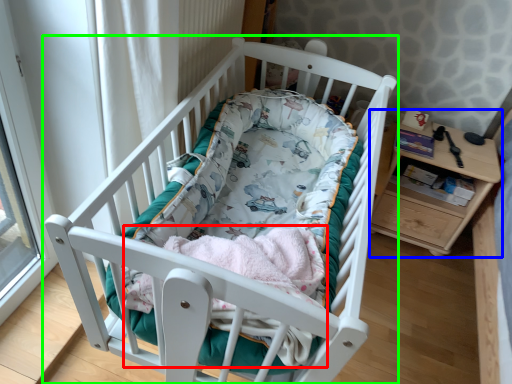
Question: Estimate the real-world distances between objects in this image. Which object is closer to baby clothe (highlighted by a red box), changing table (highlighted by a blue box) or infant bed (highlighted by a green box)?

Choices:
 (A) changing table
 (B) infant bed

Answer: (B)